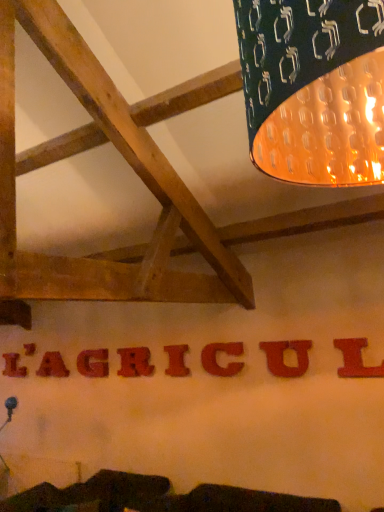
I want to click on matte red letter at center, which ranks as the 3th letter in right-to-left order, so click(216, 358).

The width and height of the screenshot is (384, 512). Describe the element at coordinates (216, 358) in the screenshot. I see `matte red letter at center, arranged as the 7th letter when viewed from the back` at that location.

What do you see at coordinates (356, 359) in the screenshot? The width and height of the screenshot is (384, 512). I see `red matte letter l at center, placed as the 1th letter when sorted from right to left` at bounding box center [356, 359].

Identify the location of velvet dark brown sofa at lower center. (155, 497).

Find the location of `matte red letter u at center, which is the 2th letter from right to left`. matte red letter u at center, which is the 2th letter from right to left is located at coordinates click(284, 359).

Considering the positions of objects red matte letter l at center, placed as the 1th letter when sorted from right to left, and red matte letter at center, acting as the seventh letter starting from the front, in the image provided, who is in front, red matte letter l at center, placed as the 1th letter when sorted from right to left, or red matte letter at center, acting as the seventh letter starting from the front,?

red matte letter l at center, placed as the 1th letter when sorted from right to left, is closer to the camera.

From the image's perspective, is red matte letter l at center, the ninth letter from the left, located above or below red matte letter at center, which ranks as the third letter in back-to-front order?

Clearly, from the image's perspective, red matte letter l at center, the ninth letter from the left, is above red matte letter at center, which ranks as the third letter in back-to-front order.

Between red matte letter l at center, the ninth letter viewed from the back, and red matte letter at center, placed as the 7th letter when sorted from right to left, which one appears on the right side from the viewer's perspective?

Positioned to the right is red matte letter l at center, the ninth letter viewed from the back.

From the image's perspective, starting from the red matte letter l at center, placed as the 1th letter when sorted from right to left, which letter is the 7th one below? Please provide its 2D coordinates.

[(52, 365)]

Who is more distant, matte red letter at center, positioned as the 6th letter in left-to-right order, or brushed metal letter l at lower left, which appears as the 1th letter when viewed from the left?

brushed metal letter l at lower left, which appears as the 1th letter when viewed from the left, is more distant.

Between matte red letter at center, which is counted as the 4th letter, starting from the front, and brushed metal letter l at lower left, which appears as the first letter when viewed from the back, which one appears on the left side from the viewer's perspective?

brushed metal letter l at lower left, which appears as the first letter when viewed from the back, is more to the left.

Based on the photo, from the image's perspective, is matte red letter at center, positioned as the 6th letter in left-to-right order, located above brushed metal letter l at lower left, which appears as the 1th letter when viewed from the left?

Yes, from the image's perspective, matte red letter at center, positioned as the 6th letter in left-to-right order, is over brushed metal letter l at lower left, which appears as the 1th letter when viewed from the left.

How distant is matte red letter at center, which is counted as the 4th letter, starting from the front, from brushed metal letter l at lower left, which appears as the first letter when viewed from the back?

matte red letter at center, which is counted as the 4th letter, starting from the front, is 6.26 feet from brushed metal letter l at lower left, which appears as the first letter when viewed from the back.

Considering the positions of points (30, 350) and (49, 503), is point (30, 350) farther from camera compared to point (49, 503)?

Yes, it is behind point (49, 503).

Based on their positions, is brushed metal letter at center, the 8th letter from the front, located to the left or right of velvet dark brown sofa at lower center?

From the image, it's evident that brushed metal letter at center, the 8th letter from the front, is to the left of velvet dark brown sofa at lower center.

Who is smaller, brushed metal letter at center, placed as the second letter when sorted from back to front, or velvet dark brown sofa at lower center?

brushed metal letter at center, placed as the second letter when sorted from back to front.

From the image's perspective, does brushed metal letter at center, marked as the 2th letter in a left-to-right arrangement, appear higher than velvet dark brown sofa at lower center?

Result: Yes, from the image's perspective, brushed metal letter at center, marked as the 2th letter in a left-to-right arrangement, is above velvet dark brown sofa at lower center.

Is velvet dark brown sofa at lower center not within brushed metal letter at center, the 8th letter from the front?

That's correct, velvet dark brown sofa at lower center is outside of brushed metal letter at center, the 8th letter from the front.

From the image's perspective, is velvet dark brown sofa at lower center on top of brushed metal letter at center, marked as the 2th letter in a left-to-right arrangement?

Actually, velvet dark brown sofa at lower center appears below brushed metal letter at center, marked as the 2th letter in a left-to-right arrangement, in the image.

Looking at this image, considering the relative positions of velvet dark brown sofa at lower center and brushed metal letter at center, the eighth letter viewed from the right, in the image provided, is velvet dark brown sofa at lower center behind brushed metal letter at center, the eighth letter viewed from the right,?

No, velvet dark brown sofa at lower center is closer to the viewer.

From a real-world perspective, count 2nd letters downward from the red matte letter at center, which appears as the 3th letter when viewed from the left, and point to it. Please provide its 2D coordinates.

[(93, 362)]

Which of these two, red matte letter at center, placed as the 7th letter when sorted from right to left, or matte red letter g at center, acting as the 4th letter starting from the back, is bigger?

red matte letter at center, placed as the 7th letter when sorted from right to left, is bigger.

Choose the correct answer: Is red matte letter at center, which appears as the 3th letter when viewed from the left, inside matte red letter g at center, which is the sixth letter in front-to-back order, or outside it?

red matte letter at center, which appears as the 3th letter when viewed from the left, exists outside the volume of matte red letter g at center, which is the sixth letter in front-to-back order.

From the image's perspective, would you say red matte letter at center, placed as the 7th letter when sorted from right to left, is positioned over matte red letter g at center, the fourth letter from the left?

No, from the image's perspective, red matte letter at center, placed as the 7th letter when sorted from right to left, is not over matte red letter g at center, the fourth letter from the left.

Would you say brushed metal letter at center, the eighth letter viewed from the right, is a long distance from red matte letter at center, acting as the seventh letter starting from the front?

No, brushed metal letter at center, the eighth letter viewed from the right, is in close proximity to red matte letter at center, acting as the seventh letter starting from the front.

From a real-world perspective, is brushed metal letter at center, the 8th letter from the front, above or below red matte letter at center, acting as the seventh letter starting from the front?

From a real-world perspective, brushed metal letter at center, the 8th letter from the front, is physically above red matte letter at center, acting as the seventh letter starting from the front.

From the image's perspective, is brushed metal letter at center, placed as the second letter when sorted from back to front, positioned above or below red matte letter at center, which ranks as the third letter in back-to-front order?

brushed metal letter at center, placed as the second letter when sorted from back to front, is above red matte letter at center, which ranks as the third letter in back-to-front order.

Looking at this image, between red matte letter at center, placed as the 7th letter when sorted from right to left, and matte red letter u at center, which is the 2th letter from right to left, which one has larger width?

With larger width is red matte letter at center, placed as the 7th letter when sorted from right to left.

Looking at this image, does red matte letter at center, which ranks as the third letter in back-to-front order, have a smaller size compared to matte red letter u at center, arranged as the 8th letter when viewed from the back?

No.

Is red matte letter at center, placed as the 7th letter when sorted from right to left, far from matte red letter u at center, arranged as the 8th letter when viewed from the back?

Absolutely, red matte letter at center, placed as the 7th letter when sorted from right to left, is distant from matte red letter u at center, arranged as the 8th letter when viewed from the back.

From the image's perspective, which one is positioned higher, red matte letter at center, which appears as the 3th letter when viewed from the left, or matte red letter u at center, which is the 2th letter from right to left?

matte red letter u at center, which is the 2th letter from right to left, appears higher in the image.

Where is `the 7th letter below the red matte letter l at center, placed as the 1th letter when sorted from right to left (from the image's perspective)`? The image size is (384, 512). the 7th letter below the red matte letter l at center, placed as the 1th letter when sorted from right to left (from the image's perspective) is located at coordinates (52, 365).

Locate an element on the screen. Image resolution: width=384 pixels, height=512 pixels. the 5th letter in front of the brushed metal letter l at lower left, which appears as the first letter when viewed from the back is located at coordinates (177, 360).

When comparing their distances from brushed metal letter at center, the 8th letter from the front, does matte red letter at center, placed as the fourth letter when sorted from right to left, or velvet dark brown sofa at lower center seem further?

The object further to brushed metal letter at center, the 8th letter from the front, is velvet dark brown sofa at lower center.

Based on their spatial positions, is matte red letter at center, the fifth letter when ordered from right to left, or brushed metal letter l at lower left, the ninth letter from the right, closer to matte red letter u at center, positioned as the 8th letter in left-to-right order?

matte red letter at center, the fifth letter when ordered from right to left, is closer to matte red letter u at center, positioned as the 8th letter in left-to-right order.

Which object lies nearer to the anchor point matte red letter at center, which appears as the sixth letter when viewed from the back, matte red letter u at center, arranged as the 8th letter when viewed from the back, or brushed metal letter l at lower left, which appears as the 1th letter when viewed from the left?

matte red letter u at center, arranged as the 8th letter when viewed from the back.

Looking at the image, which one is located further to matte red letter at center, positioned as the 6th letter in left-to-right order, brushed metal letter at center, the eighth letter viewed from the right, or matte red letter g at center, acting as the 4th letter starting from the back?

brushed metal letter at center, the eighth letter viewed from the right, is positioned further to the anchor matte red letter at center, positioned as the 6th letter in left-to-right order.

Which object lies further to the anchor point matte red letter at center, marked as the 5th letter in a back-to-front arrangement, red matte letter at center, which ranks as the third letter in back-to-front order, or velvet dark brown sofa at lower center?

Among the two, velvet dark brown sofa at lower center is located further to matte red letter at center, marked as the 5th letter in a back-to-front arrangement.

When comparing their distances from velvet dark brown sofa at lower center, does brushed metal letter l at lower left, which is the 9th letter in front-to-back order, or matte red letter g at center, acting as the 4th letter starting from the back, seem closer?

Among the two, matte red letter g at center, acting as the 4th letter starting from the back, is located nearer to velvet dark brown sofa at lower center.

When comparing their distances from matte red letter u at center, which ranks as the second letter in front-to-back order, does brushed metal letter l at lower left, which appears as the 1th letter when viewed from the left, or red matte letter l at center, the ninth letter viewed from the back, seem further?

brushed metal letter l at lower left, which appears as the 1th letter when viewed from the left, lies further to matte red letter u at center, which ranks as the second letter in front-to-back order, than the other object.

From the image, which object appears to be farther from matte red letter at center, arranged as the 7th letter when viewed from the back, matte red letter g at center, acting as the 4th letter starting from the back, or brushed metal letter at center, placed as the second letter when sorted from back to front?

brushed metal letter at center, placed as the second letter when sorted from back to front, lies further to matte red letter at center, arranged as the 7th letter when viewed from the back, than the other object.

At what (x,y) coordinates should I click in order to perform the action: click on letter between red matte letter at center, which appears as the 3th letter when viewed from the left, and matte red letter at center, the fifth letter in the left-to-right sequence. Please return your answer as a coordinate pair (x, y). This screenshot has height=512, width=384. Looking at the image, I should click on (93, 362).

Locate an element on the screen. The height and width of the screenshot is (512, 384). letter between brushed metal letter at center, the eighth letter viewed from the right, and matte red letter g at center, placed as the sixth letter when sorted from right to left, from left to right is located at coordinates (52, 365).

Find the location of a particular element. This screenshot has height=512, width=384. letter between velvet dark brown sofa at lower center and matte red letter u at center, which is the 2th letter from right to left, along the z-axis is located at coordinates (356, 359).

Where is `letter between brushed metal letter l at lower left, the ninth letter from the right, and red matte letter at center, which ranks as the third letter in back-to-front order, in the horizontal direction`? The width and height of the screenshot is (384, 512). letter between brushed metal letter l at lower left, the ninth letter from the right, and red matte letter at center, which ranks as the third letter in back-to-front order, in the horizontal direction is located at coordinates (29, 349).